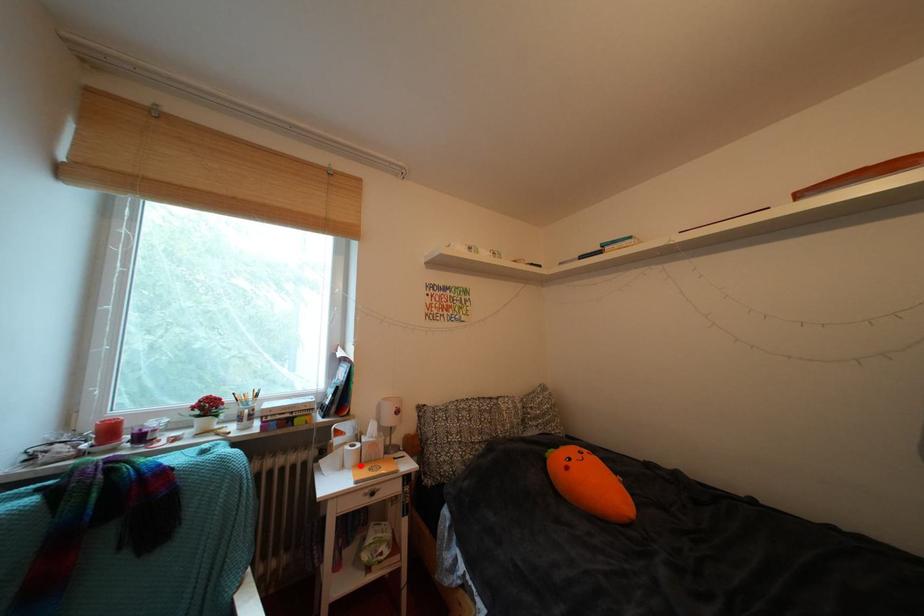
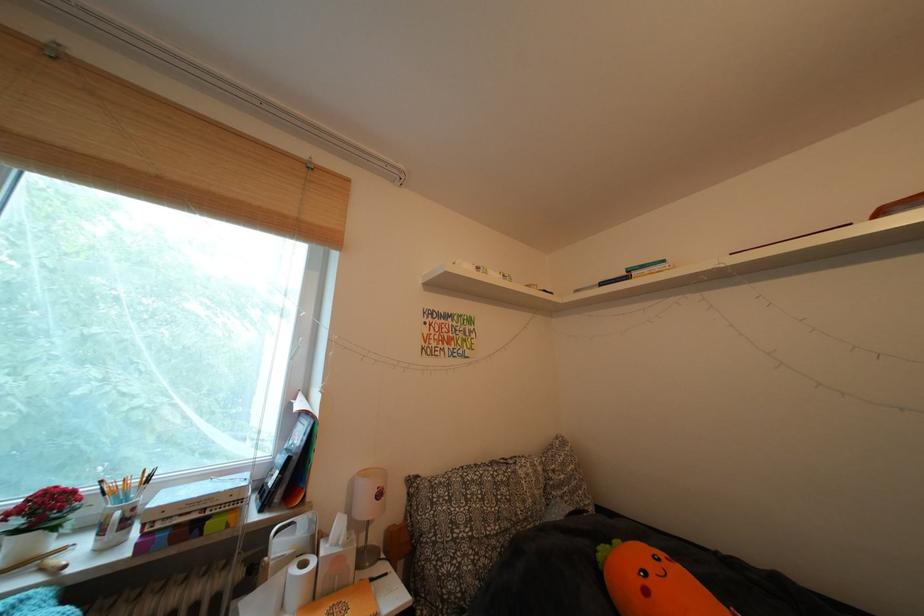
Locate, in the second image, the point that corresponds to the highlighted location in the first image.

(306, 602)